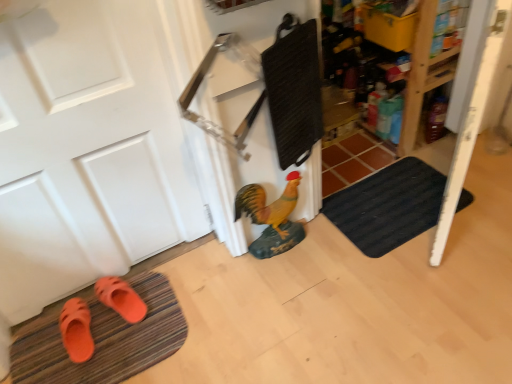
Question: Is orange rubber bath mat at lower left, which appears as the 2th bath mat when viewed from the right, taller than orange rubber sandals at lower left, the first footwear viewed from the left?

Choices:
 (A) no
 (B) yes

Answer: (A)

Question: Is orange rubber bath mat at lower left, which appears as the 2th bath mat when viewed from the right, smaller than orange rubber sandals at lower left, the 2th footwear viewed from the right?

Choices:
 (A) no
 (B) yes

Answer: (A)

Question: Could you tell me if orange rubber bath mat at lower left, which appears as the second bath mat when viewed from the top, is facing orange rubber sandals at lower left, the first footwear viewed from the left?

Choices:
 (A) yes
 (B) no

Answer: (B)

Question: Does orange rubber bath mat at lower left, the 1th bath mat in the left-to-right sequence, appear on the right side of orange rubber sandals at lower left, the 2th footwear viewed from the right?

Choices:
 (A) no
 (B) yes

Answer: (B)

Question: From a real-world perspective, is orange rubber bath mat at lower left, the 1th bath mat in the left-to-right sequence, under orange rubber sandals at lower left, the 2th footwear viewed from the right?

Choices:
 (A) no
 (B) yes

Answer: (B)

Question: From a real-world perspective, is white matte door at left positioned above or below black textured bath mat at lower right, the second bath mat positioned from the left?

Choices:
 (A) above
 (B) below

Answer: (A)

Question: Considering the positions of white matte door at left and black textured bath mat at lower right, marked as the 2th bath mat in a bottom-to-top arrangement, in the image, is white matte door at left bigger or smaller than black textured bath mat at lower right, marked as the 2th bath mat in a bottom-to-top arrangement,?

Choices:
 (A) small
 (B) big

Answer: (B)

Question: Considering the positions of white matte door at left and black textured bath mat at lower right, positioned as the first bath mat in top-to-bottom order, in the image, is white matte door at left taller or shorter than black textured bath mat at lower right, positioned as the first bath mat in top-to-bottom order,?

Choices:
 (A) short
 (B) tall

Answer: (B)

Question: Would you say white matte door at left is to the left or to the right of black textured bath mat at lower right, marked as the 2th bath mat in a bottom-to-top arrangement, in the picture?

Choices:
 (A) left
 (B) right

Answer: (A)

Question: Is orange rubber sandals at lower left, the 2th footwear viewed from the right, wider or thinner than shiny yellow chicken at center?

Choices:
 (A) thin
 (B) wide

Answer: (B)

Question: From the image's perspective, is orange rubber sandals at lower left, the 2th footwear viewed from the right, above or below shiny yellow chicken at center?

Choices:
 (A) above
 (B) below

Answer: (B)

Question: Is orange rubber sandals at lower left, the first footwear viewed from the left, inside or outside of shiny yellow chicken at center?

Choices:
 (A) outside
 (B) inside

Answer: (A)

Question: Is orange rubber sandals at lower left, the 2th footwear viewed from the right, bigger or smaller than shiny yellow chicken at center?

Choices:
 (A) small
 (B) big

Answer: (A)

Question: Looking at the image, does orange rubber bath mat at lower left, the 1th bath mat in the left-to-right sequence, seem bigger or smaller compared to white matte door at left?

Choices:
 (A) big
 (B) small

Answer: (B)

Question: In the image, is orange rubber bath mat at lower left, which appears as the 2th bath mat when viewed from the right, on the left side or the right side of white matte door at left?

Choices:
 (A) right
 (B) left

Answer: (A)